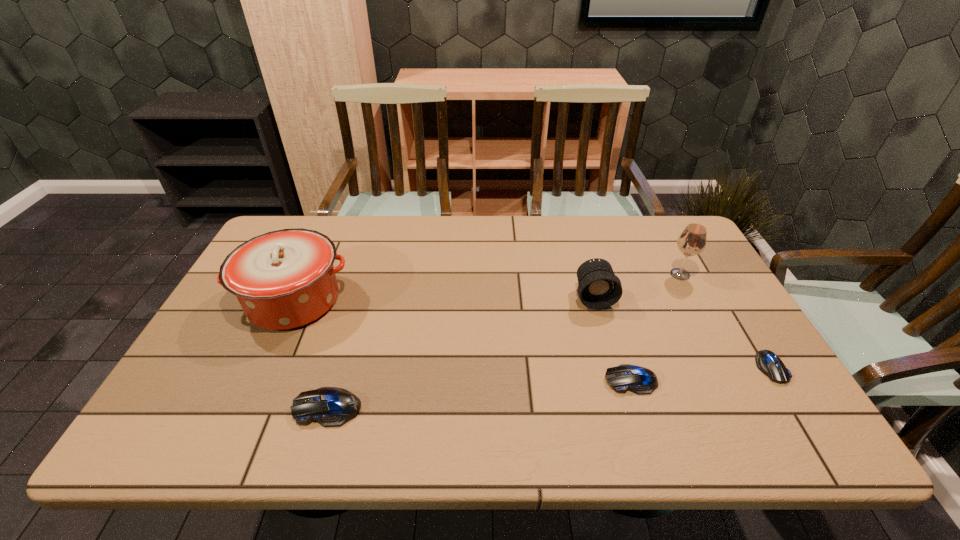
I want to click on free spot located 0.050m on the button side of the tallest computer mouse, so click(272, 408).

The height and width of the screenshot is (540, 960). Identify the location of free region located 0.160m on the button side of the tallest computer mouse. (223, 408).

Locate an element on the screen. The width and height of the screenshot is (960, 540). free region located 0.080m on the button side of the second computer mouse from left to right is located at coordinates (570, 380).

Image resolution: width=960 pixels, height=540 pixels. What are the coordinates of `vacant space located 0.190m on the button side of the second computer mouse from left to right` in the screenshot? It's located at click(524, 380).

Locate an element on the screen. free space located 0.360m on the button side of the second computer mouse from left to right is located at coordinates (452, 380).

I want to click on vacant space located on the left of the wineglass, so click(611, 274).

Where is `vacant space located 0.330m on the right of the casserole`? The height and width of the screenshot is (540, 960). vacant space located 0.330m on the right of the casserole is located at coordinates (x=468, y=300).

Locate an element on the screen. vacant space located at the front element of the telephoto lens is located at coordinates (619, 387).

At what (x,y) coordinates should I click in order to perform the action: click on object at the left edge. Please return your answer as a coordinate pair (x, y). Looking at the image, I should click on (285, 279).

At what (x,y) coordinates should I click in order to perform the action: click on computer mouse that is at the right edge. Please return your answer as a coordinate pair (x, y). The height and width of the screenshot is (540, 960). Looking at the image, I should click on (767, 362).